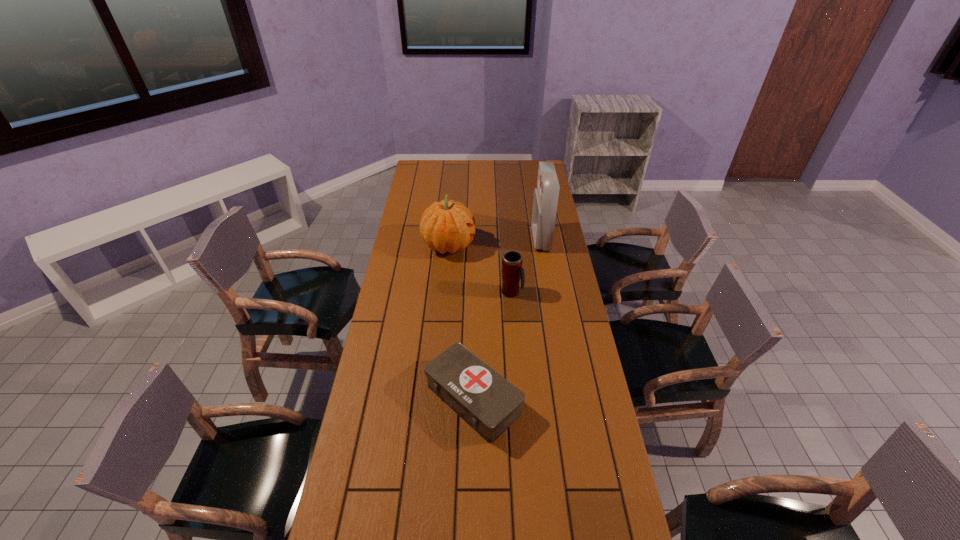
Find the location of `free space between the tallest object and the second shortest object`. free space between the tallest object and the second shortest object is located at coordinates (526, 266).

Where is `free area in between the shortest object and the second nearest object`? The image size is (960, 540). free area in between the shortest object and the second nearest object is located at coordinates (492, 346).

I want to click on free spot between the third tallest object and the pumpkin, so click(x=480, y=269).

Locate an element on the screen. The height and width of the screenshot is (540, 960). free space between the third shortest object and the thermos bottle is located at coordinates (480, 269).

The image size is (960, 540). Find the location of `blank region between the third tallest object and the left first-aid kit`. blank region between the third tallest object and the left first-aid kit is located at coordinates (492, 346).

Where is `free area in between the rightmost object and the pumpkin`? free area in between the rightmost object and the pumpkin is located at coordinates (494, 242).

At what (x,y) coordinates should I click in order to perform the action: click on blank region between the left first-aid kit and the farther first-aid kit. Please return your answer as a coordinate pair (x, y). The image size is (960, 540). Looking at the image, I should click on (507, 319).

This screenshot has height=540, width=960. I want to click on free space between the third farthest object and the second tallest object, so click(x=480, y=269).

Select which object is the third closest to the shortest object. Please provide its 2D coordinates. Your answer should be formatted as a tuple, i.e. [(x, y)], where the tuple contains the x and y coordinates of a point satisfying the conditions above.

[(545, 201)]

Select which object is the second closest to the pumpkin. Please provide its 2D coordinates. Your answer should be formatted as a tuple, i.e. [(x, y)], where the tuple contains the x and y coordinates of a point satisfying the conditions above.

[(545, 201)]